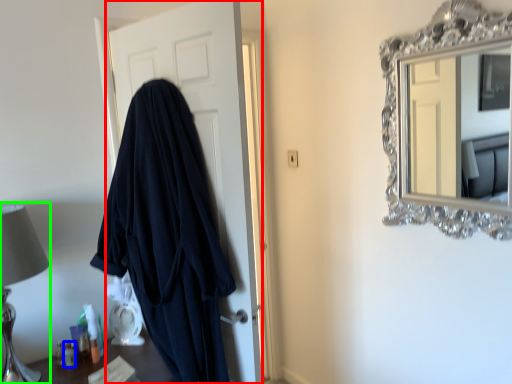
Question: Which object is positioned farthest from door (highlighted by a red box)? Select from toiletry (highlighted by a blue box) and table lamp (highlighted by a green box).

Choices:
 (A) toiletry
 (B) table lamp

Answer: (A)